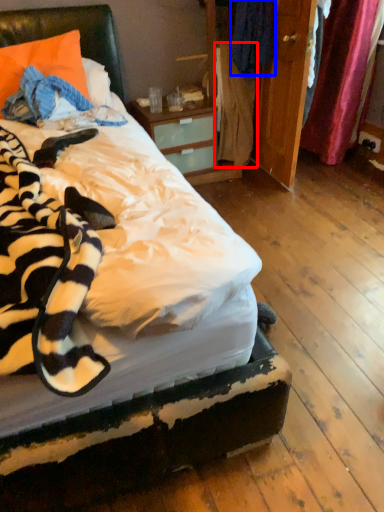
Question: Among these objects, which one is farthest to the camera, clothing (highlighted by a red box) or clothing (highlighted by a blue box)?

Choices:
 (A) clothing
 (B) clothing

Answer: (A)